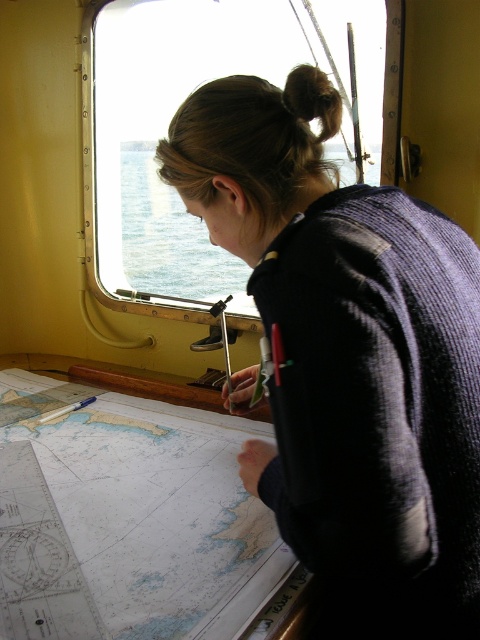
Question: Observing the image, what is the correct spatial positioning of dark blue sweater at center in reference to brown hair at upper center?

Choices:
 (A) above
 (B) below

Answer: (B)

Question: Estimate the real-world distances between objects in this image. Which object is farther from the dark blue sweater at center?

Choices:
 (A) white paper map at lower left
 (B) clear glass window at upper center

Answer: (B)

Question: Does white paper map at lower left appear on the right side of brown hair at upper center?

Choices:
 (A) no
 (B) yes

Answer: (A)

Question: Does white paper map at lower left have a lesser width compared to brown hair at upper center?

Choices:
 (A) no
 (B) yes

Answer: (A)

Question: Which of the following is the closest to the observer?

Choices:
 (A) dark blue sweater at center
 (B) brown hair at upper center

Answer: (A)

Question: Considering the real-world distances, which object is closest to the clear glass window at upper center?

Choices:
 (A) dark blue sweater at center
 (B) white paper map at lower left
 (C) brown hair at upper center

Answer: (A)